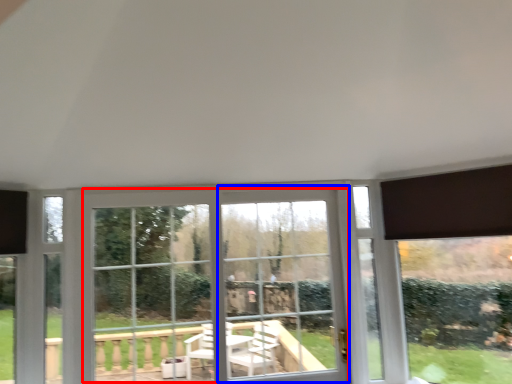
Question: Which object is closer to the camera taking this photo, bay window (highlighted by a red box) or window frame (highlighted by a blue box)?

Choices:
 (A) bay window
 (B) window frame

Answer: (A)